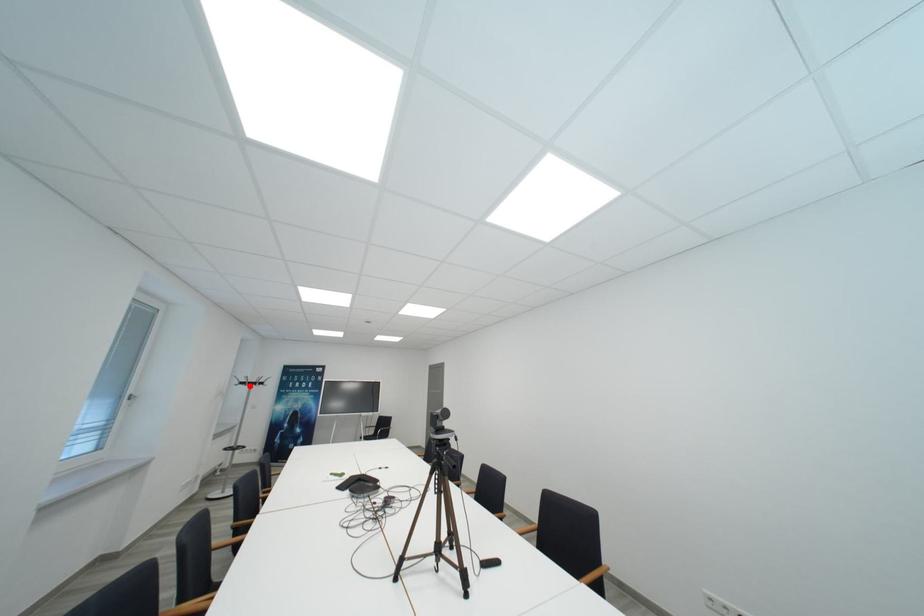
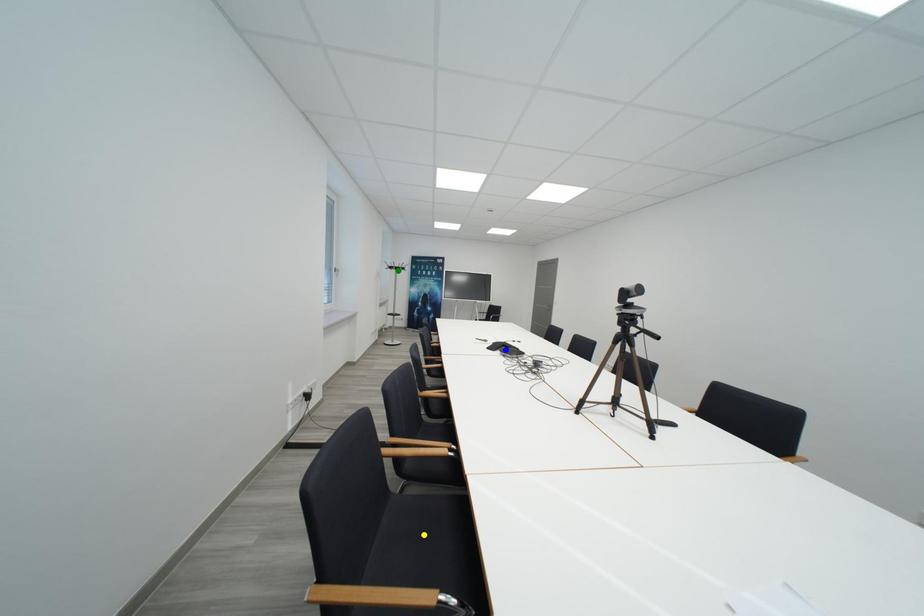
Question: I am providing you with two images of the same scene from different viewpoints. A red point is marked on the first image. You are given multiple points on the second image. Which point in image 2 represents the same 3d spot as the red point in image 1?

Choices:
 (A) blue point
 (B) yellow point
 (C) green point

Answer: (C)